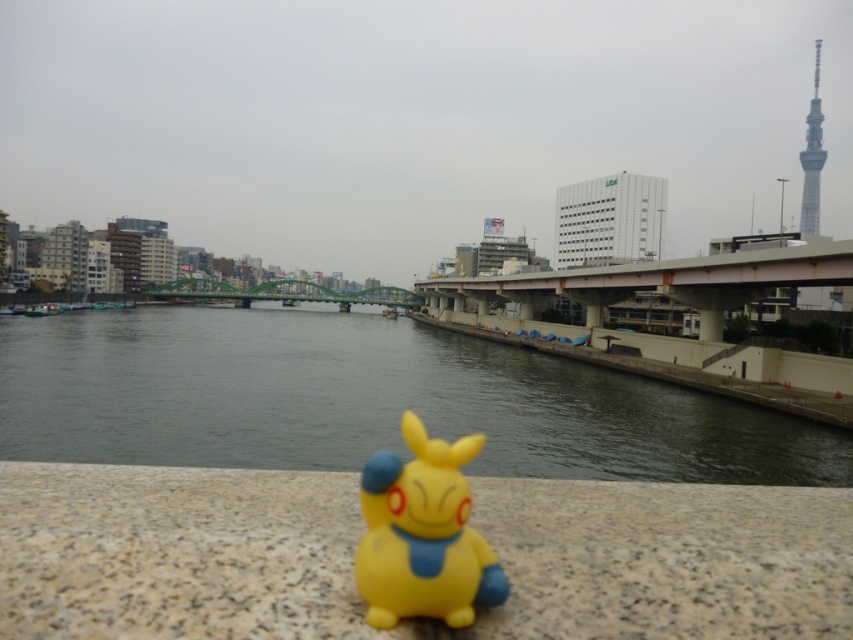
You are standing at the edge of the smooth concrete river at center. You want to throw a small stone into the river. If your arm can reach 2 meters, will you be able to reach the water?

The smooth concrete river at center and viewer are 2.18 meters apart from each other. Since your arm can only reach 2 meters, you cannot reach the water.

In the scene shown: You are a photographer trying to capture a shot of the smooth concrete river at center and the yellow matte pikachu at center. If you want to ensure both are in the frame, which object should you focus on first to ensure proper framing?

The smooth concrete river at center is wider than the yellow matte pikachu at center, so focusing on the river first will help ensure both are in the frame.

You are standing at the Pikachu toy on the stone surface. You want to walk to the point marked as point (x=372, y=605). However, there is an obstacle at point (x=547, y=388). Will you encounter the obstacle before reaching your destination?

Yes, you will encounter the obstacle at point (x=547, y=388) before reaching point (x=372, y=605) because point (x=547, y=388) is behind point (x=372, y=605).